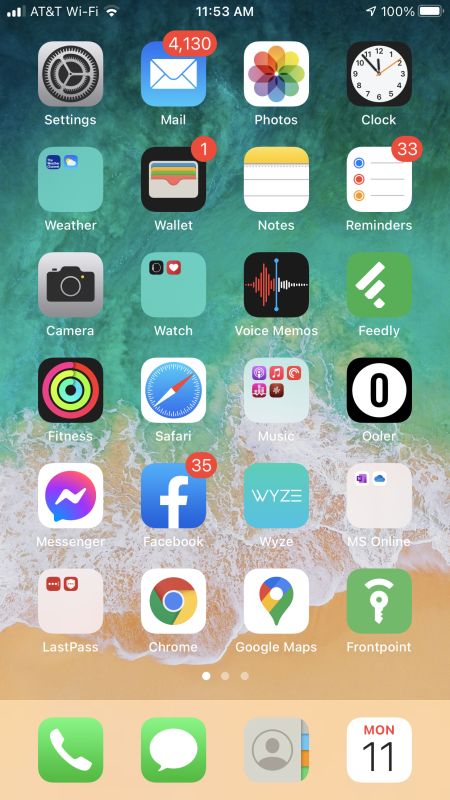
Where is `folder`? This screenshot has height=800, width=450. folder is located at coordinates (65, 602), (376, 502), (276, 406), (177, 286), (70, 182).